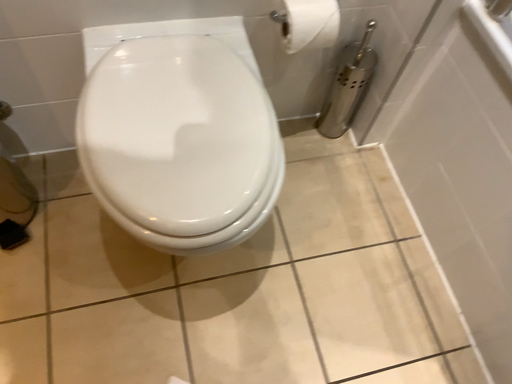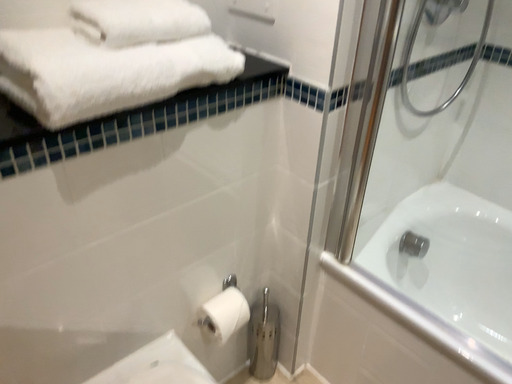
Question: Which way did the camera rotate in the video?

Choices:
 (A) rotated downward
 (B) rotated upward

Answer: (B)